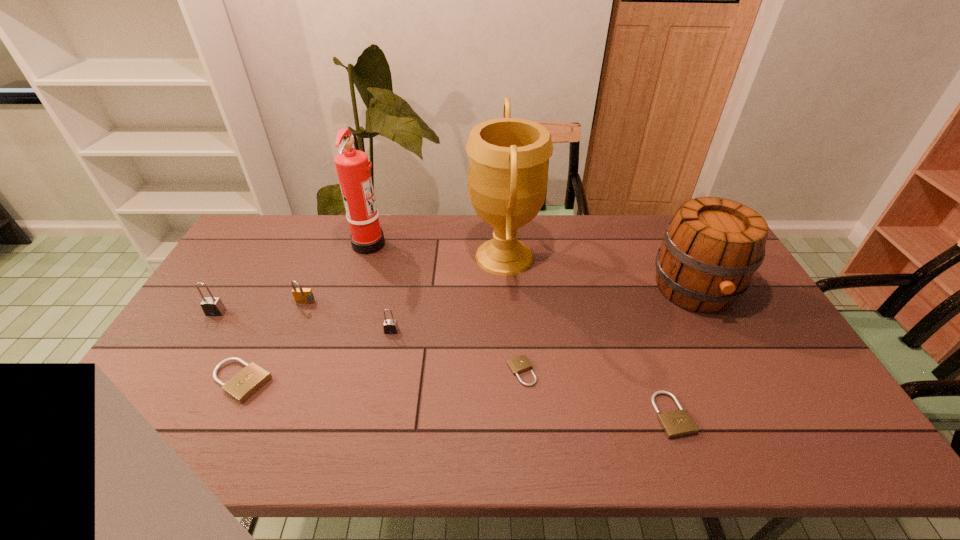
Identify the location of trophy. (507, 178).

I want to click on red fire extinguisher, so click(x=352, y=165).

Identify the location of the fourth object from left to right. (352, 165).

You are a GUI agent. You are given a task and a screenshot of the screen. Output one action in this format:
    pyautogui.click(x=<x>, y=<y>)
    Task: Click on the seventh shortest object
    Image resolution: width=960 pixels, height=540 pixels.
    Given the screenshot: What is the action you would take?
    pyautogui.click(x=711, y=248)

Where is `the rightmost object`? The image size is (960, 540). the rightmost object is located at coordinates (711, 248).

Where is `the tallest padlock`? The image size is (960, 540). the tallest padlock is located at coordinates (212, 306).

Locate an element on the screen. the leftmost object is located at coordinates (212, 306).

Where is `the farthest padlock`? This screenshot has height=540, width=960. the farthest padlock is located at coordinates (301, 295).

This screenshot has height=540, width=960. What are the coordinates of `the right gray padlock` in the screenshot? It's located at (390, 326).

You are a GUI agent. You are given a task and a screenshot of the screen. Output one action in this format:
    pyautogui.click(x=<x>, y=<y>)
    Task: Click on the fifth object from right to left
    
    Given the screenshot: What is the action you would take?
    pyautogui.click(x=390, y=326)